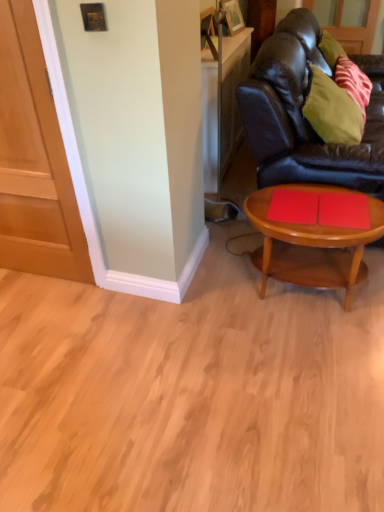
Locate an element on the screen. This screenshot has width=384, height=512. blank space to the left of wooden coffee table at lower right is located at coordinates (212, 303).